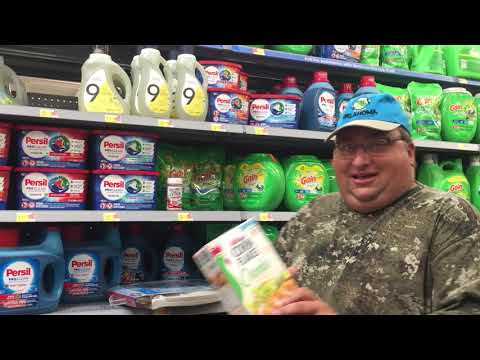
Locate an element on the screen. cereal box is located at coordinates (252, 282).